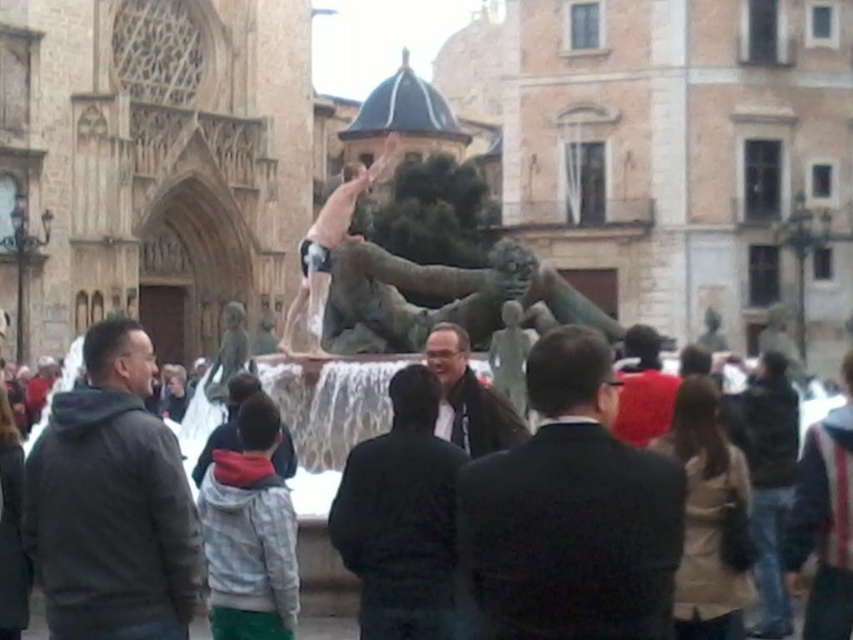
You are a photographer at the plaza and need to capture both the dark brown suit at center and the dark gray suit at center in a single frame. Which suit should you position closer to the camera to ensure both are fully visible?

To ensure both the dark brown suit at center and the dark gray suit at center are fully visible, position the dark gray suit at center closer to the camera since it is shorter than the dark brown suit at center.

You are standing at the point marked as point (543, 378). The fountain is 118.91 feet away from you. If you walk straight towards the fountain, will you be able to see the mythical creature sculpture clearly?

Yes, since the fountain is 118.91 feet away from point (543, 378), walking straight towards it would allow you to approach the fountain and see the mythical creature sculpture clearly.